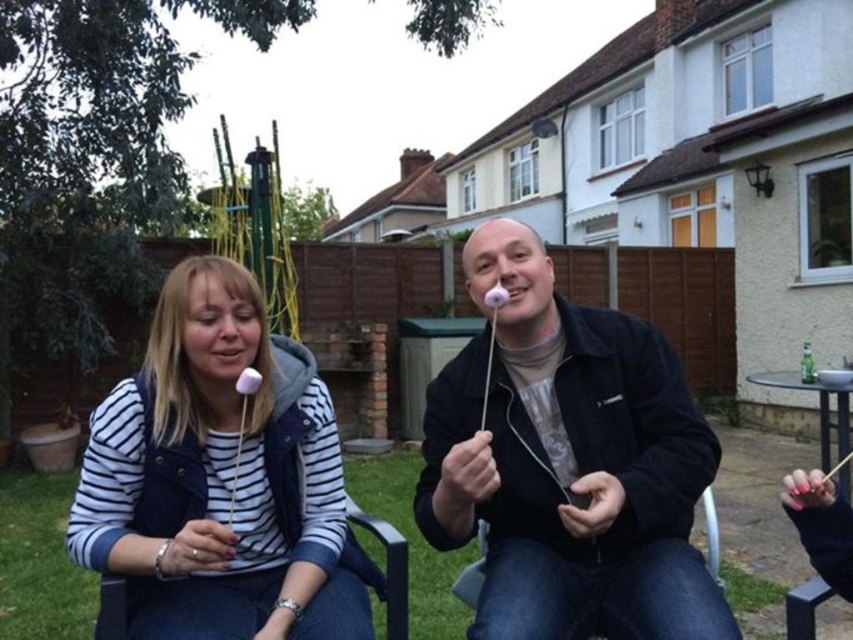
Does white marshmallow at center come in front of white striped shirt at center?

Yes, it is.

Is point (602, 589) positioned before point (267, 412)?

Yes, it is in front of point (267, 412).

Is point (585, 621) less distant than point (171, 412)?

Yes, it is in front of point (171, 412).

The width and height of the screenshot is (853, 640). Find the location of `white marshmallow at center`. white marshmallow at center is located at coordinates click(x=567, y=464).

Between white marshmallow at center and white matte marshmallow at center, which one has less height?

white marshmallow at center is shorter.

Describe the element at coordinates (567, 464) in the screenshot. The image size is (853, 640). I see `white marshmallow at center` at that location.

Who is more forward, (173, 461) or (630, 424)?

Point (173, 461) is more forward.

Locate an element on the screen. This screenshot has height=640, width=853. white marshmallow at center is located at coordinates (567, 464).

Does point (682, 579) come closer to viewer compared to point (325, 614)?

That is True.

Who is more forward, (490, 508) or (247, 556)?

Point (490, 508) is in front.

Is point (540, 372) farther from camera compared to point (219, 579)?

No, (540, 372) is closer to viewer.

This screenshot has width=853, height=640. In order to click on white matte marshmallow at center in this screenshot , I will do pos(567,464).